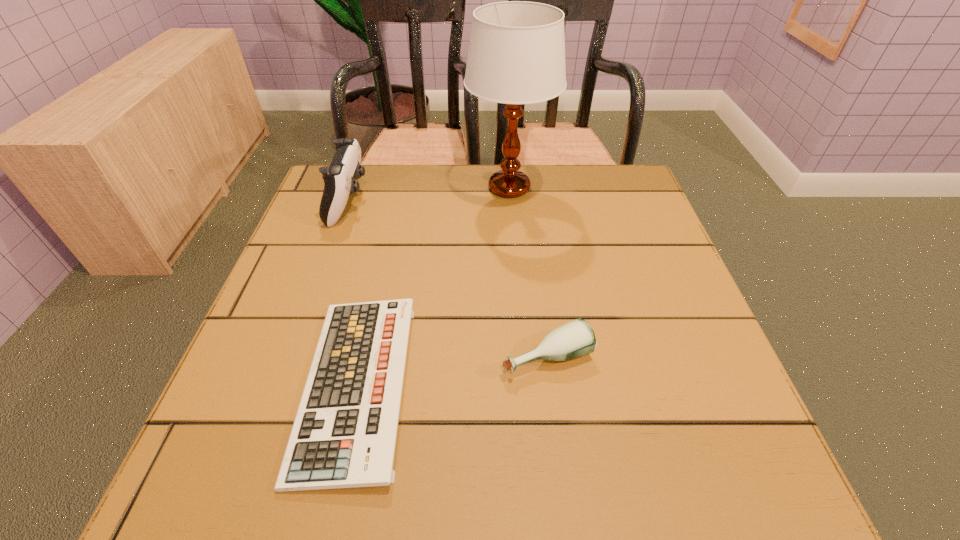
You are a GUI agent. You are given a task and a screenshot of the screen. Output one action in this format:
    pyautogui.click(x=<x>, y=<y>)
    Task: Click on the free space between the bottle and the tallest object
    This screenshot has width=960, height=540.
    Given the screenshot: What is the action you would take?
    pyautogui.click(x=528, y=272)

Image resolution: width=960 pixels, height=540 pixels. Identify the location of free point between the shortest object and the second shortest object. (451, 370).

Choose which object is the third nearest neighbor to the shortest object. Please provide its 2D coordinates. Your answer should be formatted as a tuple, i.e. [(x, y)], where the tuple contains the x and y coordinates of a point satisfying the conditions above.

[(516, 55)]

This screenshot has height=540, width=960. I want to click on object that is the third closest to the control, so click(x=574, y=339).

Locate an element on the screen. This screenshot has width=960, height=540. free space that satisfies the following two spatial constraints: 1. on the front-facing side of the third shortest object; 2. on the right side of the third tallest object is located at coordinates (294, 356).

Image resolution: width=960 pixels, height=540 pixels. What are the coordinates of `vacant position in the image that satisfies the following two spatial constraints: 1. on the back side of the computer keyboard; 2. on the left side of the table lamp` in the screenshot? It's located at (400, 188).

The width and height of the screenshot is (960, 540). In order to click on free spot that satisfies the following two spatial constraints: 1. on the front-facing side of the bottle; 2. on the left side of the third shortest object in this screenshot , I will do click(x=294, y=356).

Locate an element on the screen. This screenshot has width=960, height=540. vacant area in the image that satisfies the following two spatial constraints: 1. on the front-facing side of the second tallest object; 2. on the right side of the bottle is located at coordinates (294, 356).

Image resolution: width=960 pixels, height=540 pixels. What are the coordinates of `vacant space that satisfies the following two spatial constraints: 1. on the front-facing side of the second tallest object; 2. on the back side of the bottle` in the screenshot? It's located at (294, 356).

At what (x,y) coordinates should I click in order to perform the action: click on free spot that satisfies the following two spatial constraints: 1. on the front-facing side of the computer keyboard; 2. on the left side of the second tallest object. Please return your answer as a coordinate pair (x, y). The width and height of the screenshot is (960, 540). Looking at the image, I should click on (283, 386).